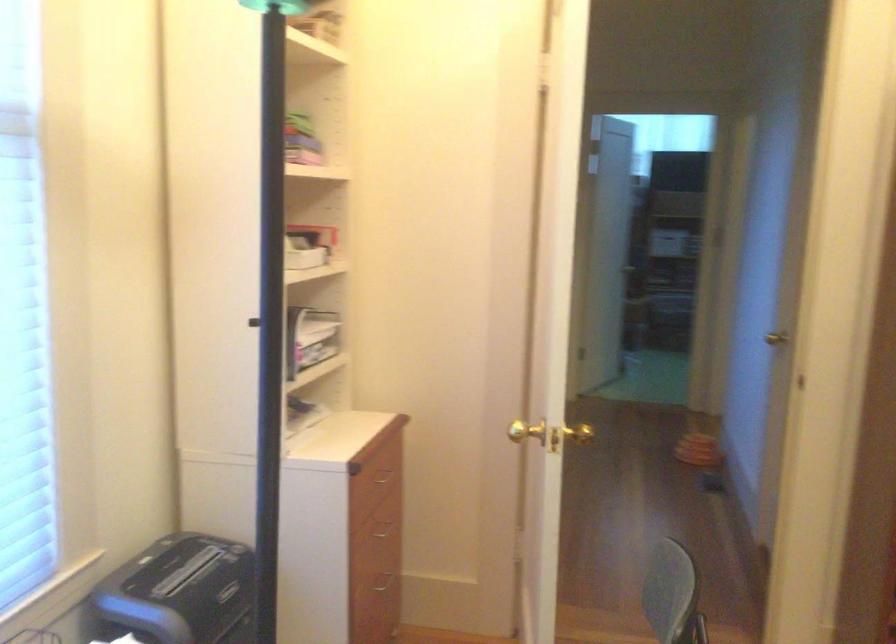
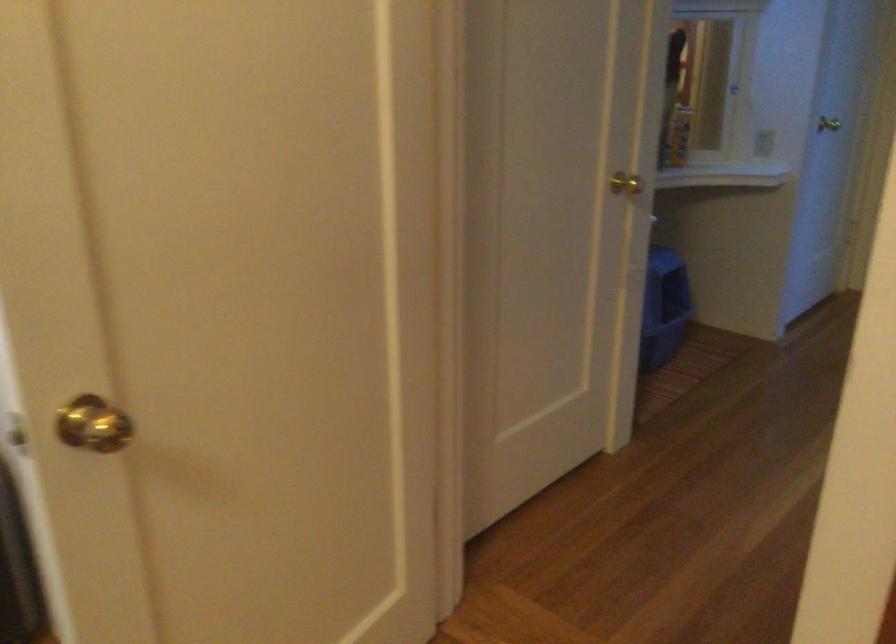
Question: I am providing you with two images of the same scene from different viewpoints. Please identify which objects are invisible in image2.

Choices:
 (A) clear oil bottle
 (B) blue litter box
 (C) drawer handle
 (D) brass doorknob

Answer: (C)